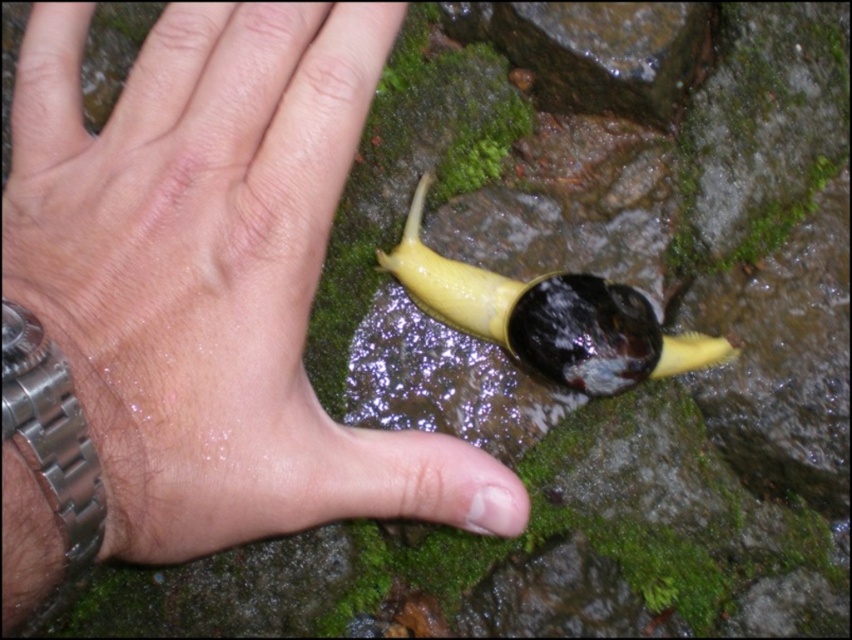
Looking at this image, you are a photographer trying to capture a close shot of the yellow rubber snail at center. However, the skinny silver watch at lower left is blocking your view. Can you move the watch to get a clear shot of the snail?

The skinny silver watch at lower left is in front of the yellow rubber snail at center, so moving the watch would allow you to see the snail clearly.

You are a jeweler examining a watch and a toy snail in the image. The watch is labeled as the skinny silver watch at lower left, and the toy snail is the yellow rubber snail at center. Which object is bigger?

The skinny silver watch at lower left is larger in size than the yellow rubber snail at center.